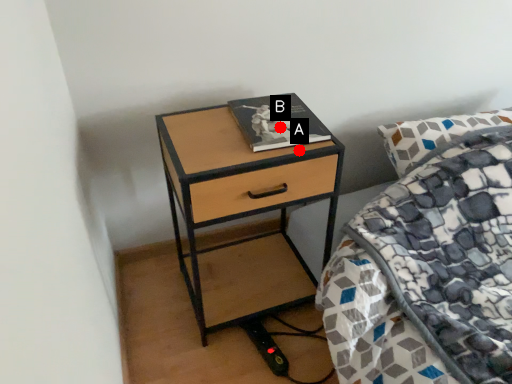
Question: Two points are circled on the image, labeled by A and B beside each circle. Which point appears farthest from the camera in this image?

Choices:
 (A) A is further
 (B) B is further

Answer: (B)